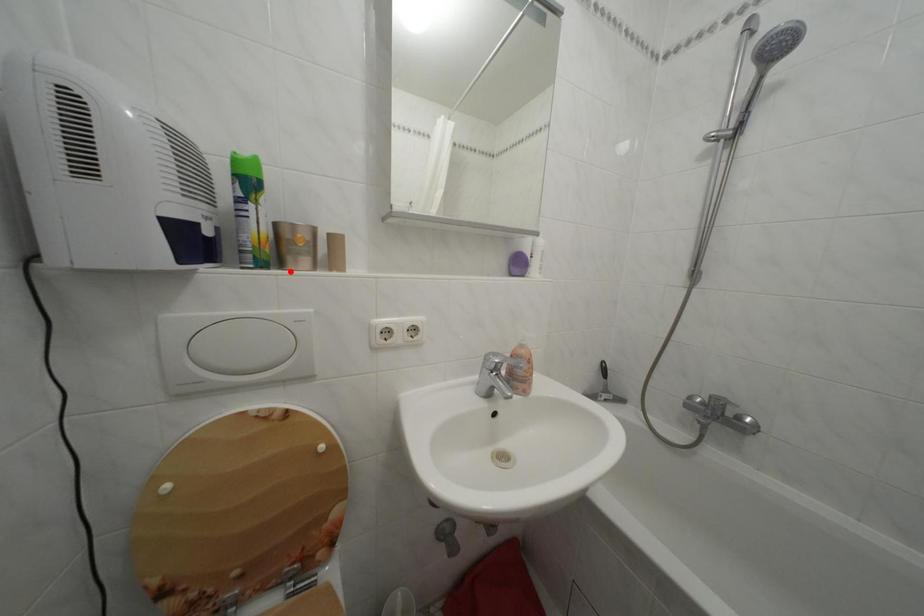
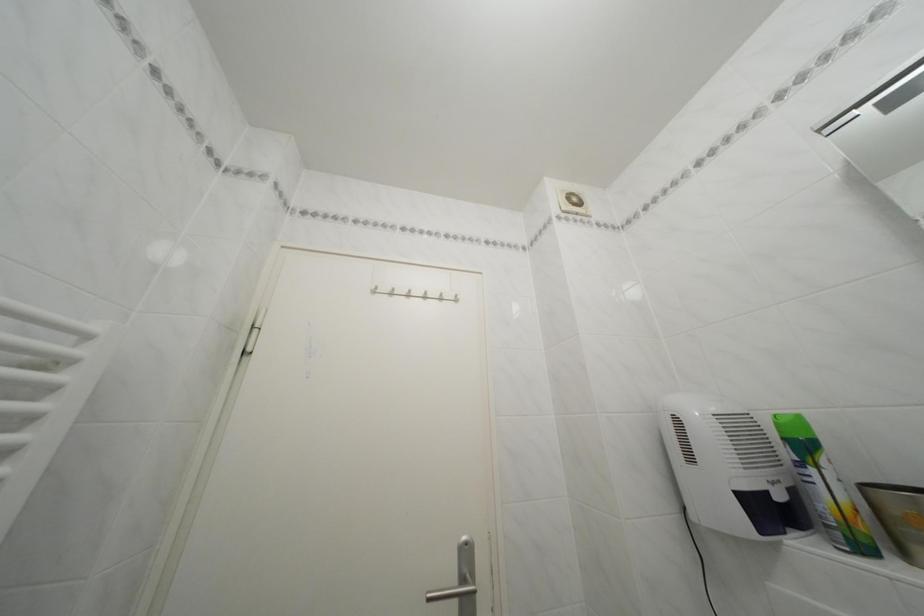
Where in the second image is the point corresponding to the highlighted location from the first image?

(915, 561)